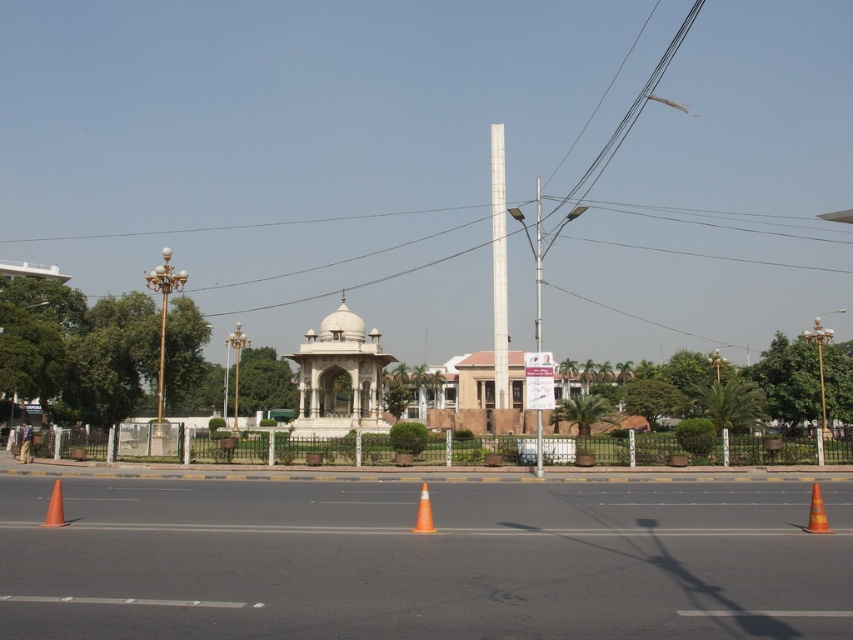
Question: Does orange reflective cone at lower right come behind orange reflective cone at center?

Choices:
 (A) no
 (B) yes

Answer: (A)

Question: Which is farther from the orange reflective cone at center?

Choices:
 (A) white marble gazebo at center
 (B) orange matte traffic cone at center

Answer: (A)

Question: Which point is farther to the camera?

Choices:
 (A) orange reflective cone at center
 (B) orange matte traffic cone at center
 (C) white marble gazebo at center
 (D) orange reflective cone at lower right

Answer: (C)

Question: Observing the image, what is the correct spatial positioning of white marble gazebo at center in reference to orange reflective cone at center?

Choices:
 (A) right
 (B) left

Answer: (B)

Question: Which point is closer to the camera?

Choices:
 (A) (55, 490)
 (B) (416, 515)
 (C) (805, 531)
 (D) (303, 400)

Answer: (C)

Question: Does orange matte traffic cone at center appear over orange reflective cone at center?

Choices:
 (A) no
 (B) yes

Answer: (A)